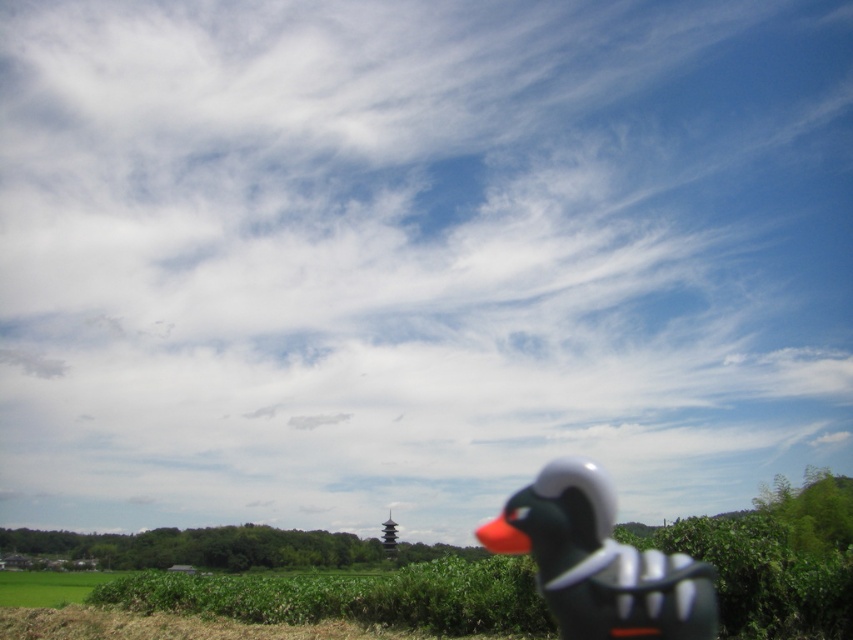
Question: Among these points, which one is farthest from the camera?

Choices:
 (A) (671, 563)
 (B) (50, 579)

Answer: (B)

Question: Is matte black rubber duck at lower right smaller than green grass at lower left?

Choices:
 (A) yes
 (B) no

Answer: (B)

Question: From the image, what is the correct spatial relationship of matte black rubber duck at lower right in relation to green grass at lower left?

Choices:
 (A) left
 (B) right

Answer: (B)

Question: Does matte black rubber duck at lower right appear over green grass at lower left?

Choices:
 (A) yes
 (B) no

Answer: (A)